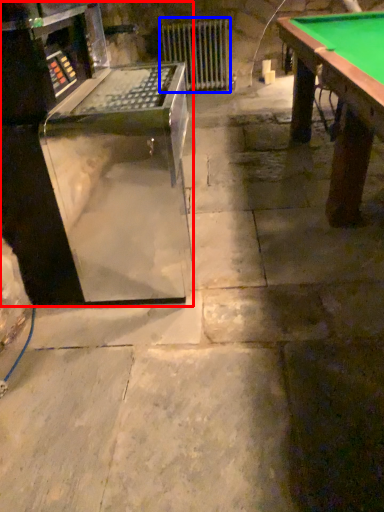
Question: Among these objects, which one is farthest to the camera, equipment (highlighted by a red box) or radiator (highlighted by a blue box)?

Choices:
 (A) equipment
 (B) radiator

Answer: (B)